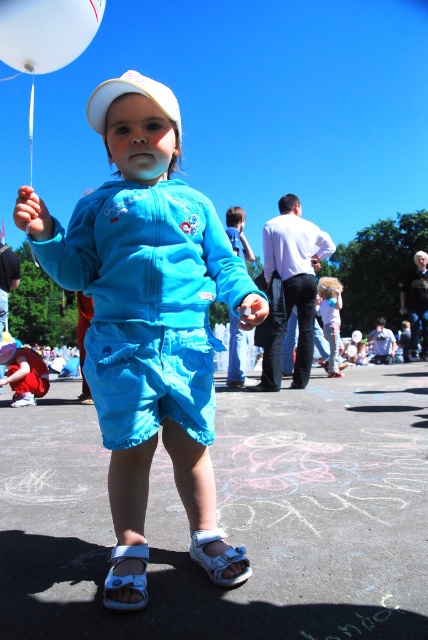
Based on the scene description, can you determine which object at the center is bigger between the white matte hat at center and the light blue denim shorts at center?

The white matte hat at center is larger in size than the light blue denim shorts at center.

You are a photographer trying to capture the child in the turquoise hoodie and shorts. The camera you are using has a focus point at coordinate point (330, 317). According to the scene, where is this focus point located?

The focus point at coordinate point (330, 317) is located on the blue denim shorts at center.

You are a delivery robot that needs to place a package on the smooth asphalt at center. However, there is a blue fabric sandal at lower center in the way. Can you move the sandal to make space?

The smooth asphalt at center is not as tall as blue fabric sandal at lower center, so the blue fabric sandal at lower center is taller. Since the sandal is taller than the asphalt, you can move it to the side to clear the space for the package.